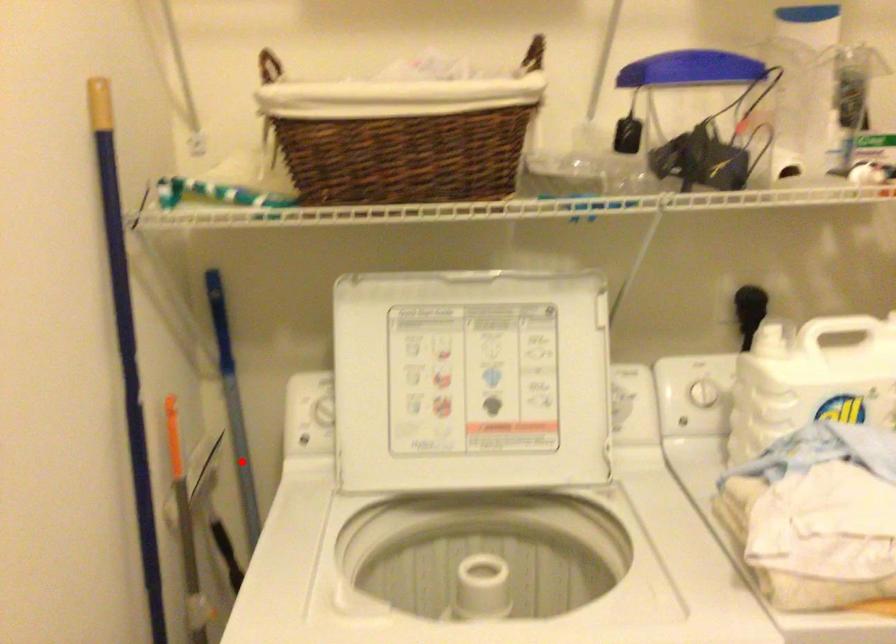
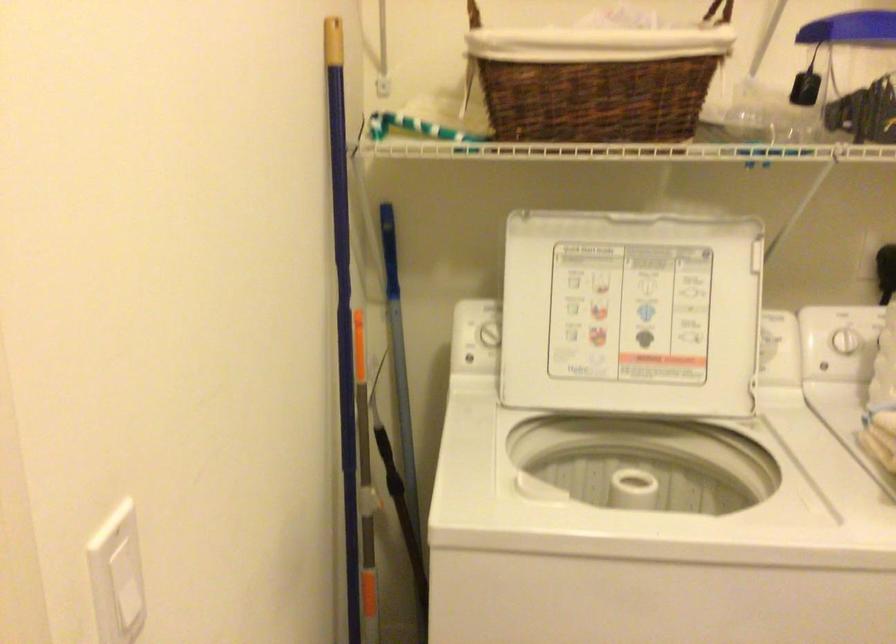
Find the pixel in the second image that matches the highlighted location in the first image.

(400, 379)